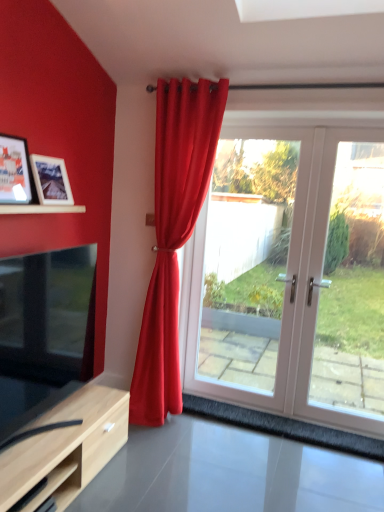
Question: Does point (314, 227) appear closer or farther from the camera than point (57, 479)?

Choices:
 (A) closer
 (B) farther

Answer: (B)

Question: Considering the positions of white glossy glass door at right and wooden shelf at lower left in the image, is white glossy glass door at right taller or shorter than wooden shelf at lower left?

Choices:
 (A) tall
 (B) short

Answer: (A)

Question: Which is nearer to the white glossy door at center?

Choices:
 (A) wooden picture frame at left, which ranks as the first picture frame in front-to-back order
 (B) matte red curtain at center
 (C) matte black tv at lower left
 (D) matte wooden picture frame at upper left, the 1th picture frame when ordered from back to front
 (E) white glossy glass door at right

Answer: (E)

Question: Estimate the real-world distances between objects in this image. Which object is farther from the matte wooden picture frame at upper left, the 2th picture frame in the front-to-back sequence?

Choices:
 (A) wooden picture frame at left, which ranks as the first picture frame in front-to-back order
 (B) white glossy door at center
 (C) wooden shelf at lower left
 (D) matte black tv at lower left
 (E) white glossy glass door at right

Answer: (B)